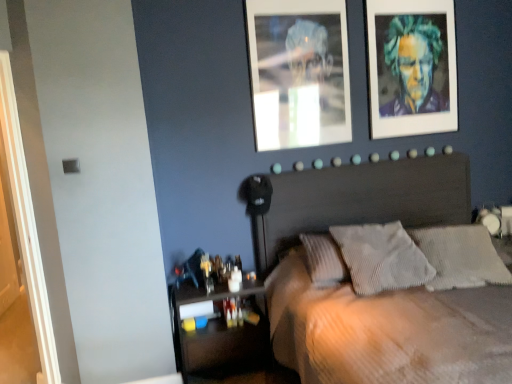
Question: Is gray corduroy pillow at center, which is the 1th pillow from right to left, with multicolored textured portrait at upper right?

Choices:
 (A) yes
 (B) no

Answer: (B)

Question: Can you confirm if gray corduroy pillow at center, which is the 1th pillow from right to left, is shorter than multicolored textured portrait at upper right?

Choices:
 (A) yes
 (B) no

Answer: (A)

Question: Considering the relative positions of gray corduroy pillow at center, which is the 1th pillow from right to left, and multicolored textured portrait at upper right in the image provided, is gray corduroy pillow at center, which is the 1th pillow from right to left, in front of multicolored textured portrait at upper right?

Choices:
 (A) no
 (B) yes

Answer: (B)

Question: Considering the relative sizes of gray corduroy pillow at center, which is the 1th pillow from right to left, and multicolored textured portrait at upper right in the image provided, is gray corduroy pillow at center, which is the 1th pillow from right to left, smaller than multicolored textured portrait at upper right?

Choices:
 (A) yes
 (B) no

Answer: (B)

Question: Is gray corduroy pillow at center, which is the 1th pillow from right to left, at the left side of multicolored textured portrait at upper right?

Choices:
 (A) yes
 (B) no

Answer: (B)

Question: From a real-world perspective, does gray corduroy pillow at center, which is the 2th pillow from left to right, stand above multicolored textured portrait at upper right?

Choices:
 (A) yes
 (B) no

Answer: (B)

Question: From a real-world perspective, is metallic silver photo frame at upper center below multicolored textured portrait at upper right?

Choices:
 (A) yes
 (B) no

Answer: (B)

Question: Can you confirm if metallic silver photo frame at upper center is positioned to the right of multicolored textured portrait at upper right?

Choices:
 (A) no
 (B) yes

Answer: (A)

Question: Does metallic silver photo frame at upper center have a greater width compared to multicolored textured portrait at upper right?

Choices:
 (A) yes
 (B) no

Answer: (B)

Question: Could multicolored textured portrait at upper right be considered to be inside metallic silver photo frame at upper center?

Choices:
 (A) no
 (B) yes

Answer: (A)

Question: Does metallic silver photo frame at upper center have a lesser height compared to multicolored textured portrait at upper right?

Choices:
 (A) no
 (B) yes

Answer: (A)

Question: Considering the relative sizes of metallic silver photo frame at upper center and multicolored textured portrait at upper right in the image provided, is metallic silver photo frame at upper center smaller than multicolored textured portrait at upper right?

Choices:
 (A) yes
 (B) no

Answer: (A)

Question: Considering the relative sizes of white painted wood door at left and translucent plastic shelf at lower left in the image provided, is white painted wood door at left thinner than translucent plastic shelf at lower left?

Choices:
 (A) yes
 (B) no

Answer: (A)